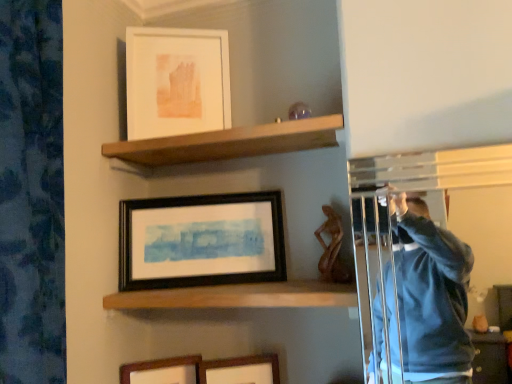
In order to face wooden shelf at upper center, which is counted as the first shelf, starting from the top, should I rotate leftwards or rightwards?

You should look left and rotate roughly 3.859 degrees.

The height and width of the screenshot is (384, 512). Describe the element at coordinates (163, 371) in the screenshot. I see `wooden picture frame at lower center, which is the fourth picture frame in top-to-bottom order` at that location.

The width and height of the screenshot is (512, 384). In order to click on white matte picture frame at upper center, arranged as the first picture frame when viewed from the top in this screenshot , I will do `click(176, 81)`.

Between wooden shelf at center, the 1th shelf in the bottom-to-top sequence, and wooden picture frame at lower center, which is the first picture frame from bottom to top, which one appears on the left side from the viewer's perspective?

From the viewer's perspective, wooden picture frame at lower center, which is the first picture frame from bottom to top, appears more on the left side.

In terms of height, does wooden shelf at center, which is the 2th shelf in top-to-bottom order, look taller or shorter compared to wooden picture frame at lower center, which is the fourth picture frame in top-to-bottom order?

wooden shelf at center, which is the 2th shelf in top-to-bottom order, is shorter than wooden picture frame at lower center, which is the fourth picture frame in top-to-bottom order.

Can you confirm if wooden shelf at center, which is the 2th shelf in top-to-bottom order, is wider than wooden picture frame at lower center, which is the first picture frame from bottom to top?

Indeed, wooden shelf at center, which is the 2th shelf in top-to-bottom order, has a greater width compared to wooden picture frame at lower center, which is the first picture frame from bottom to top.

Does wooden shelf at center, which is the 2th shelf in top-to-bottom order, have a larger size compared to wooden picture frame at lower center, which is the fourth picture frame in top-to-bottom order?

Yes.

Can you tell me how much black matte picture frame at center, the third picture frame in the bottom-to-top sequence, and white matte picture frame at upper center, the fourth picture frame positioned from the bottom, differ in facing direction?

The facing directions of black matte picture frame at center, the third picture frame in the bottom-to-top sequence, and white matte picture frame at upper center, the fourth picture frame positioned from the bottom, are 9.98 degrees apart.

From the picture: Which point is more distant from viewer, (251, 270) or (181, 70)?

The point (181, 70) is farther.

From a real-world perspective, which is physically below, black matte picture frame at center, the third picture frame in the bottom-to-top sequence, or white matte picture frame at upper center, arranged as the first picture frame when viewed from the top?

From a 3D spatial view, black matte picture frame at center, the third picture frame in the bottom-to-top sequence, is below.

Are black matte picture frame at center, the third picture frame in the bottom-to-top sequence, and white matte picture frame at upper center, the fourth picture frame positioned from the bottom, far apart?

No.

From a real-world perspective, is wooden picture frame at lower center, the second picture frame from the bottom, positioned above or below wooden shelf at upper center, which ranks as the 2th shelf in bottom-to-top order?

wooden picture frame at lower center, the second picture frame from the bottom, is situated lower than wooden shelf at upper center, which ranks as the 2th shelf in bottom-to-top order, in the real world.

From the picture: Is wooden picture frame at lower center, the second picture frame from the bottom, far away from wooden shelf at upper center, which ranks as the 2th shelf in bottom-to-top order?

→ No, wooden picture frame at lower center, the second picture frame from the bottom, is in close proximity to wooden shelf at upper center, which ranks as the 2th shelf in bottom-to-top order.

Is the position of wooden picture frame at lower center, the 3th picture frame from the top, more distant than that of wooden shelf at upper center, which ranks as the 2th shelf in bottom-to-top order?

Yes, it is.

From a real-world perspective, is wooden shelf at center, the 1th shelf in the bottom-to-top sequence, on top of wooden picture frame at lower center, the second picture frame from the bottom?

Yes.

Does wooden shelf at center, the 1th shelf in the bottom-to-top sequence, have a greater width compared to wooden picture frame at lower center, the 3th picture frame from the top?

Yes, wooden shelf at center, the 1th shelf in the bottom-to-top sequence, is wider than wooden picture frame at lower center, the 3th picture frame from the top.

Is wooden shelf at center, which is the 2th shelf in top-to-bottom order, touching wooden picture frame at lower center, the 3th picture frame from the top?

No, wooden shelf at center, which is the 2th shelf in top-to-bottom order, is not making contact with wooden picture frame at lower center, the 3th picture frame from the top.

From a real-world perspective, is wooden picture frame at lower center, which is the first picture frame from bottom to top, on top of black matte picture frame at center, the third picture frame in the bottom-to-top sequence?

No, from a real-world perspective, wooden picture frame at lower center, which is the first picture frame from bottom to top, is not over black matte picture frame at center, the third picture frame in the bottom-to-top sequence

Is wooden picture frame at lower center, which is the first picture frame from bottom to top, bigger than black matte picture frame at center, which ranks as the 2th picture frame in top-to-bottom order?

No, wooden picture frame at lower center, which is the first picture frame from bottom to top, is not bigger than black matte picture frame at center, which ranks as the 2th picture frame in top-to-bottom order.

Considering the positions of point (149, 367) and point (192, 254), is point (149, 367) closer or farther from the camera than point (192, 254)?

Point (149, 367) appears to be closer to the viewer than point (192, 254).

How far apart are wooden picture frame at lower center, which is the first picture frame from bottom to top, and black matte picture frame at center, the third picture frame in the bottom-to-top sequence?

wooden picture frame at lower center, which is the first picture frame from bottom to top, is 12.41 inches from black matte picture frame at center, the third picture frame in the bottom-to-top sequence.

Are wooden shelf at upper center, which is counted as the first shelf, starting from the top, and white matte picture frame at upper center, the fourth picture frame positioned from the bottom, beside each other?

wooden shelf at upper center, which is counted as the first shelf, starting from the top, and white matte picture frame at upper center, the fourth picture frame positioned from the bottom, are not in contact.

From the picture: Can you confirm if wooden shelf at upper center, which is counted as the first shelf, starting from the top, is smaller than white matte picture frame at upper center, the fourth picture frame positioned from the bottom?

Incorrect, wooden shelf at upper center, which is counted as the first shelf, starting from the top, is not smaller in size than white matte picture frame at upper center, the fourth picture frame positioned from the bottom.

From the image's perspective, is wooden shelf at upper center, which is counted as the first shelf, starting from the top, positioned above or below white matte picture frame at upper center, the fourth picture frame positioned from the bottom?

Clearly, from the image's perspective, wooden shelf at upper center, which is counted as the first shelf, starting from the top, is below white matte picture frame at upper center, the fourth picture frame positioned from the bottom.

Which is behind, wooden shelf at upper center, which ranks as the 2th shelf in bottom-to-top order, or white matte picture frame at upper center, the fourth picture frame positioned from the bottom?

Positioned behind is white matte picture frame at upper center, the fourth picture frame positioned from the bottom.

From a real-world perspective, is white matte picture frame at upper center, arranged as the first picture frame when viewed from the top, above or below wooden picture frame at lower center, which is the first picture frame from bottom to top?

In terms of real-world spatial position, white matte picture frame at upper center, arranged as the first picture frame when viewed from the top, is above wooden picture frame at lower center, which is the first picture frame from bottom to top.

Between white matte picture frame at upper center, arranged as the first picture frame when viewed from the top, and wooden picture frame at lower center, which is the first picture frame from bottom to top, which one has smaller width?

white matte picture frame at upper center, arranged as the first picture frame when viewed from the top.

From the image's perspective, is white matte picture frame at upper center, arranged as the first picture frame when viewed from the top, under wooden picture frame at lower center, which is the first picture frame from bottom to top?

No, from the image's perspective, white matte picture frame at upper center, arranged as the first picture frame when viewed from the top, is not beneath wooden picture frame at lower center, which is the first picture frame from bottom to top.

Between point (199, 98) and point (180, 380), which one is positioned behind?

The point (199, 98) is farther.

Identify the location of the 2nd picture frame positioned below the wooden shelf at center, the 1th shelf in the bottom-to-top sequence (from a real-world perspective). (x=163, y=371).

You are a GUI agent. You are given a task and a screenshot of the screen. Output one action in this format:
    pyautogui.click(x=<x>, y=<y>)
    Task: Click on the 1st picture frame to the right when counting from the white matte picture frame at upper center, arranged as the first picture frame when viewed from the top
    Image resolution: width=512 pixels, height=384 pixels.
    Given the screenshot: What is the action you would take?
    pyautogui.click(x=201, y=241)

From the picture: When comparing their distances from wooden picture frame at lower center, the 3th picture frame from the top, does wooden picture frame at lower center, which is the fourth picture frame in top-to-bottom order, or wooden shelf at center, which is the 2th shelf in top-to-bottom order, seem further?

Among the two, wooden shelf at center, which is the 2th shelf in top-to-bottom order, is located further to wooden picture frame at lower center, the 3th picture frame from the top.

Which object lies nearer to the anchor point wooden shelf at upper center, which ranks as the 2th shelf in bottom-to-top order, wooden picture frame at lower center, the second picture frame from the bottom, or black matte picture frame at center, which ranks as the 2th picture frame in top-to-bottom order?

black matte picture frame at center, which ranks as the 2th picture frame in top-to-bottom order.

Estimate the real-world distances between objects in this image. Which object is further from wooden shelf at upper center, which is counted as the first shelf, starting from the top, wooden shelf at center, the 1th shelf in the bottom-to-top sequence, or wooden picture frame at lower center, the 3th picture frame from the top?

wooden picture frame at lower center, the 3th picture frame from the top, lies further to wooden shelf at upper center, which is counted as the first shelf, starting from the top, than the other object.

When comparing their distances from wooden shelf at upper center, which ranks as the 2th shelf in bottom-to-top order, does wooden picture frame at lower center, the second picture frame from the bottom, or wooden shelf at center, which is the 2th shelf in top-to-bottom order, seem closer?

wooden shelf at center, which is the 2th shelf in top-to-bottom order.

Estimate the real-world distances between objects in this image. Which object is further from white matte picture frame at upper center, the fourth picture frame positioned from the bottom, wooden shelf at upper center, which is counted as the first shelf, starting from the top, or wooden shelf at center, which is the 2th shelf in top-to-bottom order?

Based on the image, wooden shelf at center, which is the 2th shelf in top-to-bottom order, appears to be further to white matte picture frame at upper center, the fourth picture frame positioned from the bottom.

Looking at the image, which one is located further to wooden shelf at center, which is the 2th shelf in top-to-bottom order, wooden shelf at upper center, which is counted as the first shelf, starting from the top, or wooden picture frame at lower center, which is the fourth picture frame in top-to-bottom order?

wooden shelf at upper center, which is counted as the first shelf, starting from the top, lies further to wooden shelf at center, which is the 2th shelf in top-to-bottom order, than the other object.

Considering their positions, is wooden shelf at upper center, which ranks as the 2th shelf in bottom-to-top order, positioned closer to wooden picture frame at lower center, which is the fourth picture frame in top-to-bottom order, than wooden picture frame at lower center, the second picture frame from the bottom?

wooden picture frame at lower center, the second picture frame from the bottom, is closer to wooden picture frame at lower center, which is the fourth picture frame in top-to-bottom order.

Estimate the real-world distances between objects in this image. Which object is further from wooden picture frame at lower center, which is the first picture frame from bottom to top, wooden shelf at center, which is the 2th shelf in top-to-bottom order, or white matte picture frame at upper center, the fourth picture frame positioned from the bottom?

white matte picture frame at upper center, the fourth picture frame positioned from the bottom, is positioned further to the anchor wooden picture frame at lower center, which is the first picture frame from bottom to top.

This screenshot has width=512, height=384. Find the location of `shelf between black matte picture frame at center, the third picture frame in the bottom-to-top sequence, and wooden picture frame at lower center, the 3th picture frame from the top, in the vertical direction`. shelf between black matte picture frame at center, the third picture frame in the bottom-to-top sequence, and wooden picture frame at lower center, the 3th picture frame from the top, in the vertical direction is located at coordinates (239, 296).

The width and height of the screenshot is (512, 384). I want to click on shelf between white matte picture frame at upper center, arranged as the first picture frame when viewed from the top, and black matte picture frame at center, which ranks as the 2th picture frame in top-to-bottom order, in the up-down direction, so click(x=230, y=142).

Where is `picture frame between black matte picture frame at center, the third picture frame in the bottom-to-top sequence, and wooden picture frame at lower center, which is the first picture frame from bottom to top, in the up-down direction`? This screenshot has height=384, width=512. picture frame between black matte picture frame at center, the third picture frame in the bottom-to-top sequence, and wooden picture frame at lower center, which is the first picture frame from bottom to top, in the up-down direction is located at coordinates (241, 370).

Identify the location of picture frame between wooden shelf at upper center, which is counted as the first shelf, starting from the top, and wooden picture frame at lower center, the 3th picture frame from the top, in the up-down direction. (201, 241).